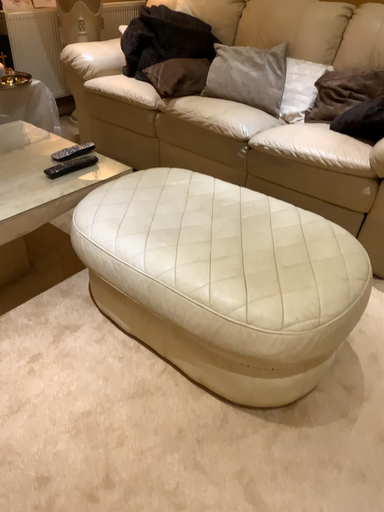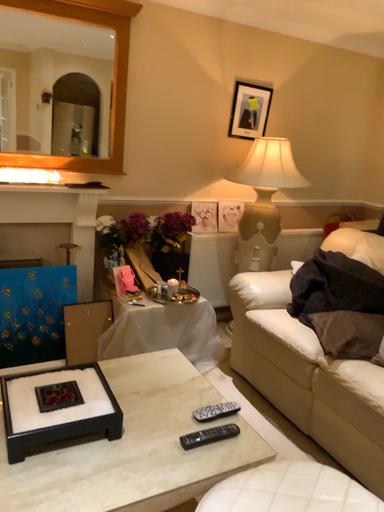
Question: How did the camera likely rotate when shooting the video?

Choices:
 (A) rotated upward
 (B) rotated downward

Answer: (A)